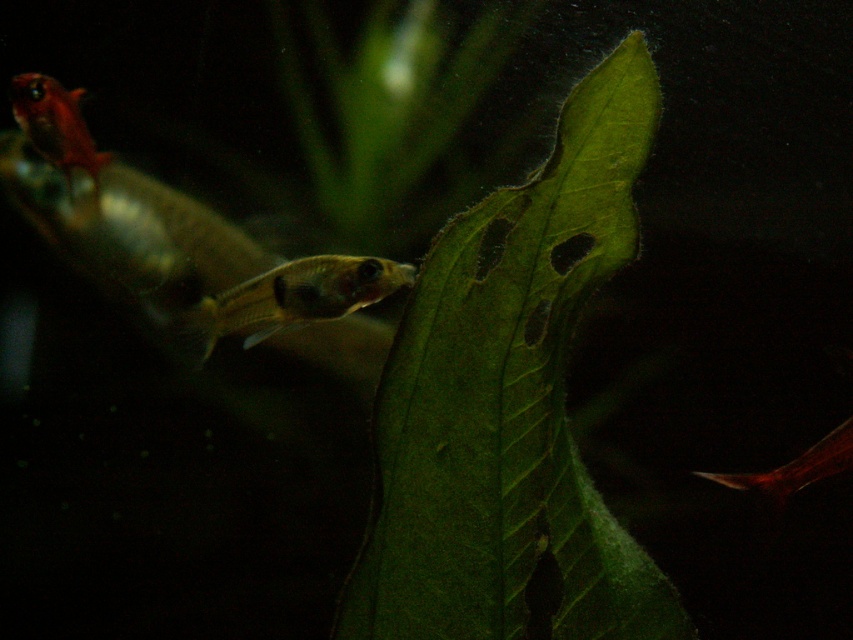
You are an underwater photographer aiming to capture both the translucent yellow fish at center and the matte orange fish at upper left in a single frame. Given their sizes, which fish should you focus on first to ensure both are in the shot?

The translucent yellow fish at center is bigger than the matte orange fish at upper left. To ensure both are in the shot, focus on the translucent yellow fish at center first as it requires more space in the frame.

You are an underwater photographer aiming to capture the matte orange fish at upper left. You have a camera with a focus range of 0.05 to 0.15 units. The focus point is set at point (55,125). Will the matte orange fish at upper left be in focus?

The point (55,125) marks the matte orange fish at upper left, so yes, the matte orange fish at upper left will be in focus since the focus point is set exactly on it.